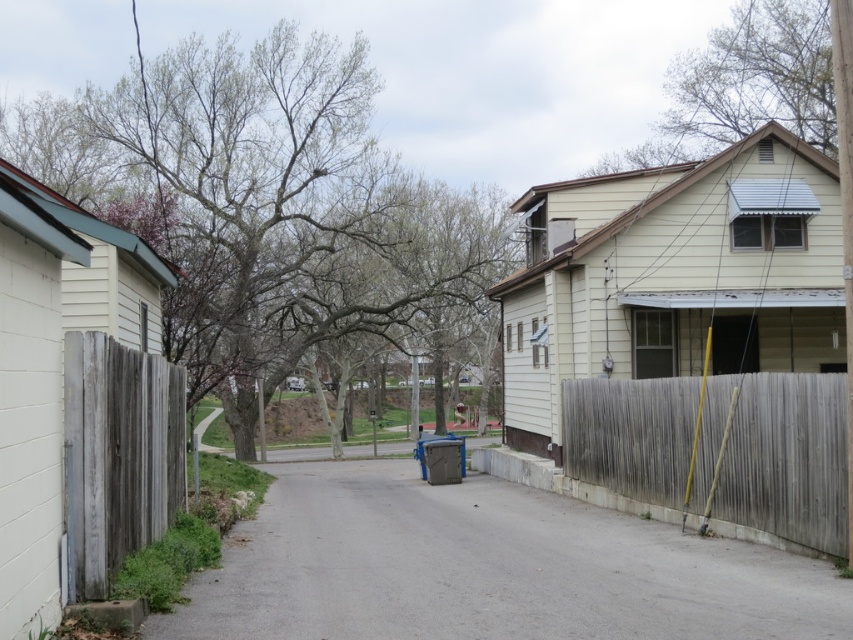
You are a painter planning to paint both the weathered wood fence at right and the weathered wood fence at left. Which fence requires less paint if they are the same height?

The weathered wood fence at right requires less paint because it has a lesser width compared to the weathered wood fence at left.

You are standing at the entrance of the residential street and want to park your car. The car requires a parking space that is at least 5 meters long. Is the gray concrete driveway at lower center long enough for your car?

The gray concrete driveway at lower center is located at point (x=486, y=570). However, the length of the driveway is not provided in the description, so it is impossible to determine if it is long enough for a car requiring 5 meters.

You are standing on the residential street and see both the weathered wood fence at right and the weathered wood fence at left. Which fence is positioned closer to the street curve that is in the center of the image?

The weathered wood fence at right is closer to the street curve in the center because it is positioned to the right of the weathered wood fence at left, and the street curves to the right in the center.